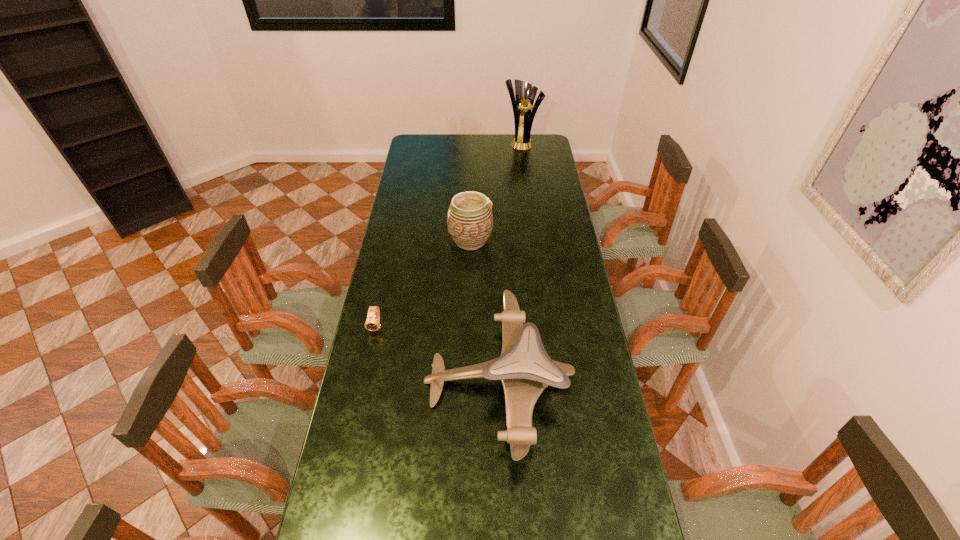
Locate an element on the screen. vacant point located between the third tallest object and the award is located at coordinates (510, 261).

The image size is (960, 540). Identify the location of blank region between the leftmost object and the award. (449, 234).

Where is `empty space between the second tallest object and the leftmost object`? empty space between the second tallest object and the leftmost object is located at coordinates (x=423, y=284).

Identify the location of unoccupied position between the pottery and the watch. Image resolution: width=960 pixels, height=540 pixels. (423, 284).

The height and width of the screenshot is (540, 960). Identify the location of blank region between the leftmost object and the second tallest object. (423, 284).

This screenshot has height=540, width=960. In order to click on free space between the third nearest object and the leftmost object in this screenshot , I will do `click(423, 284)`.

You are a GUI agent. You are given a task and a screenshot of the screen. Output one action in this format:
    pyautogui.click(x=<x>, y=<y>)
    Task: Click on the free space between the pottery and the second shortest object
    The image size is (960, 540).
    Given the screenshot: What is the action you would take?
    pyautogui.click(x=484, y=311)

Find the location of a particular element. vacant point located between the second tallest object and the drone is located at coordinates (484, 311).

Locate which object is the third closest to the pottery. Please provide its 2D coordinates. Your answer should be formatted as a tuple, i.e. [(x, y)], where the tuple contains the x and y coordinates of a point satisfying the conditions above.

[(525, 93)]

Locate which object is the second closest to the farthest object. Please provide its 2D coordinates. Your answer should be formatted as a tuple, i.e. [(x, y)], where the tuple contains the x and y coordinates of a point satisfying the conditions above.

[(525, 369)]